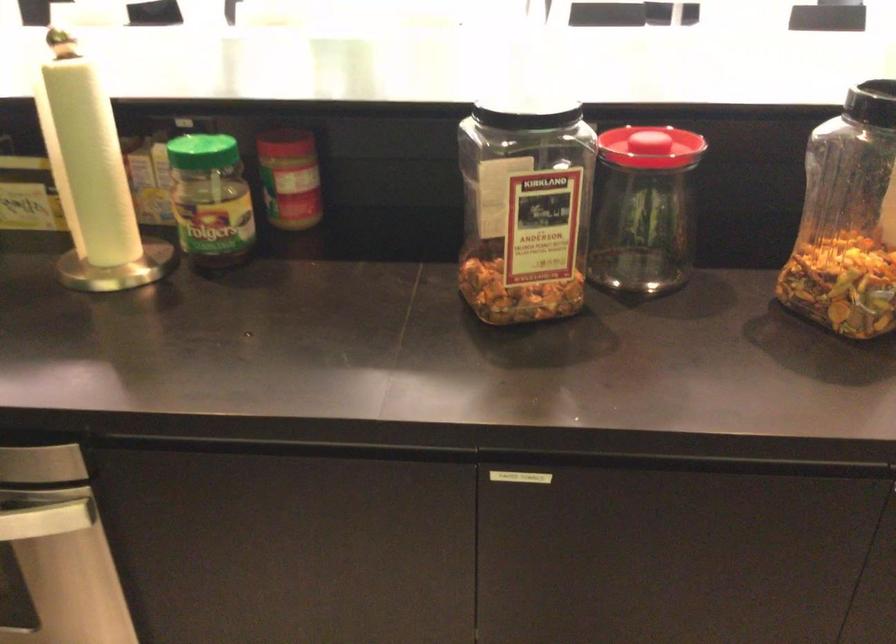
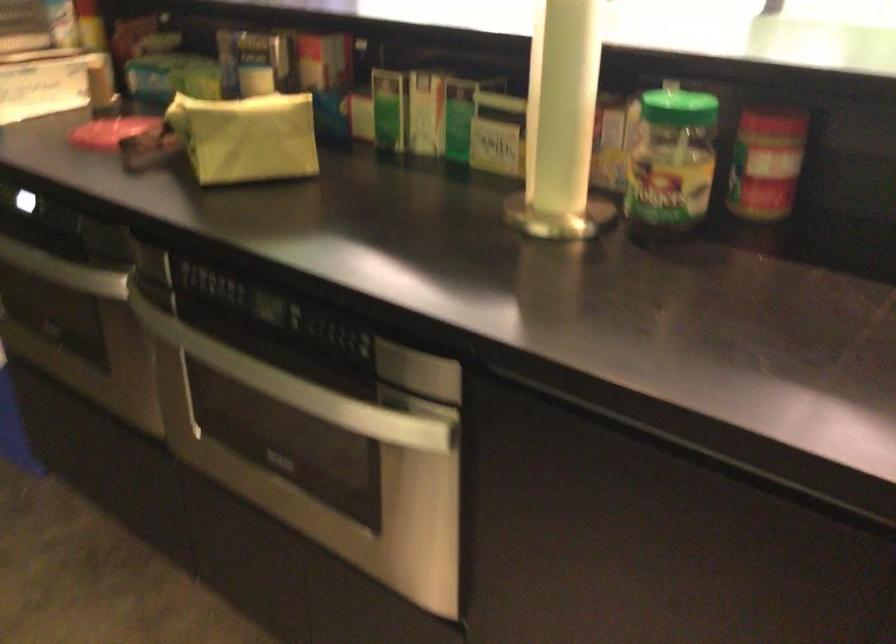
Question: The first image is from the beginning of the video and the second image is from the end. How did the camera likely rotate when shooting the video?

Choices:
 (A) Left
 (B) Right
 (C) Up
 (D) Down

Answer: (A)